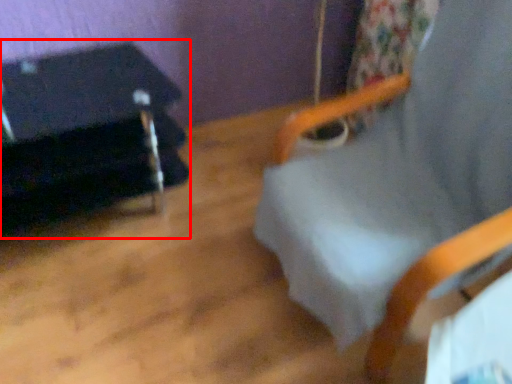
Question: From the image's perspective, what is the correct spatial positioning of furniture (annotated by the red box) in reference to beach chair?

Choices:
 (A) above
 (B) below

Answer: (A)